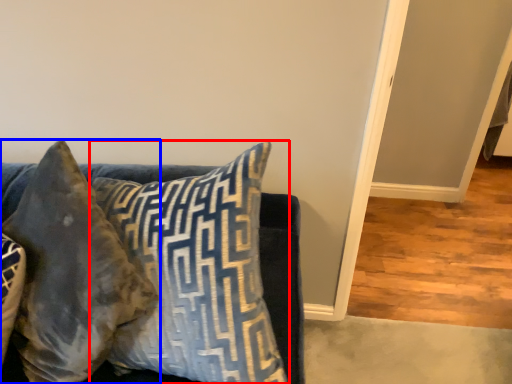
Question: Which point is further to the camera, pillow (highlighted by a red box) or pillow (highlighted by a blue box)?

Choices:
 (A) pillow
 (B) pillow

Answer: (B)